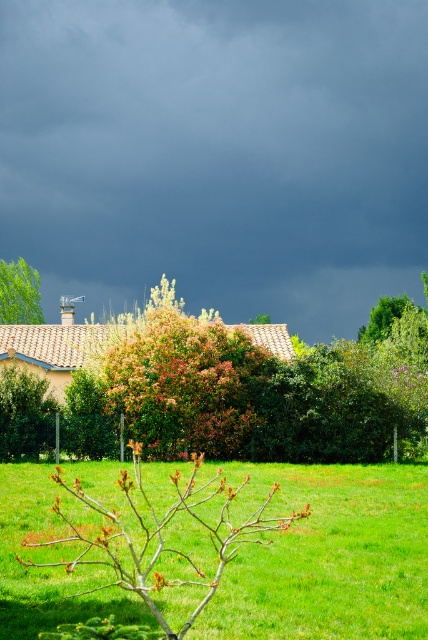
Which of these two, dark gray cloud at upper center or green leafy tree at center, stands taller?

Standing taller between the two is dark gray cloud at upper center.

Can you confirm if dark gray cloud at upper center is wider than green leafy tree at center?

Yes, dark gray cloud at upper center is wider than green leafy tree at center.

Where is `dark gray cloud at upper center`? The height and width of the screenshot is (640, 428). dark gray cloud at upper center is located at coordinates (217, 154).

Is dark gray cloud at upper center above green grass at lower center?

Indeed, dark gray cloud at upper center is positioned over green grass at lower center.

Does dark gray cloud at upper center lie in front of green grass at lower center?

No, dark gray cloud at upper center is further to the viewer.

Which is behind, point (380, 236) or point (351, 467)?

The point (380, 236) is behind.

The image size is (428, 640). In order to click on dark gray cloud at upper center in this screenshot , I will do `click(217, 154)`.

Can you confirm if green grass at lower center is shorter than green leafy tree at center?

Correct, green grass at lower center is not as tall as green leafy tree at center.

Can you confirm if green grass at lower center is positioned above green leafy tree at center?

No, green grass at lower center is not above green leafy tree at center.

This screenshot has height=640, width=428. What do you see at coordinates (327, 556) in the screenshot? I see `green grass at lower center` at bounding box center [327, 556].

Where is `green grass at lower center`? The height and width of the screenshot is (640, 428). green grass at lower center is located at coordinates (327, 556).